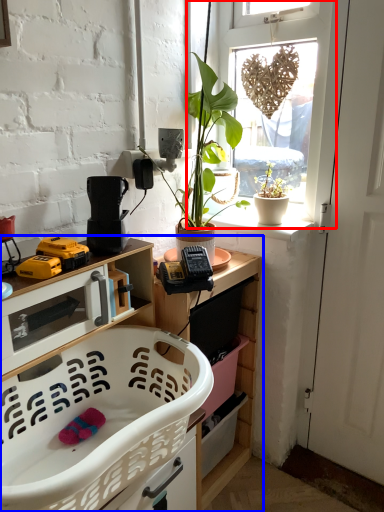
Question: Which of the following is the farthest to the observer, window (highlighted by a red box) or cabinetry (highlighted by a blue box)?

Choices:
 (A) window
 (B) cabinetry

Answer: (A)